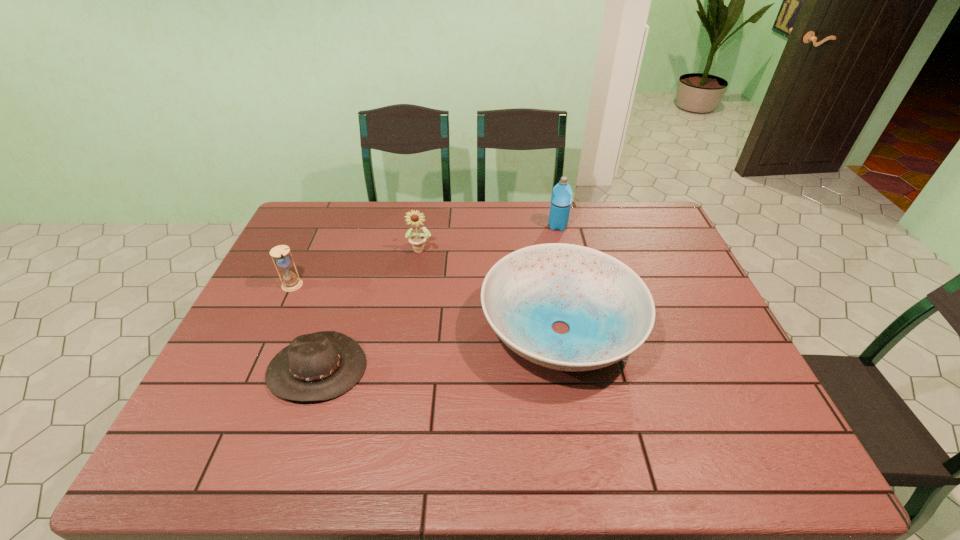
Image resolution: width=960 pixels, height=540 pixels. What are the coordinates of `the farthest object` in the screenshot? It's located at (561, 198).

Where is `the third object from left to right`? the third object from left to right is located at coordinates click(x=417, y=240).

Identify the location of sunflower. (417, 240).

Find the location of a particular element. hourglass is located at coordinates (290, 282).

What are the coordinates of `the second shortest object` in the screenshot? It's located at (610, 312).

Locate an element on the screen. The height and width of the screenshot is (540, 960). the shortest object is located at coordinates (320, 366).

The height and width of the screenshot is (540, 960). In order to click on the fourth object from right to left in this screenshot , I will do `click(320, 366)`.

Locate an element on the screen. The image size is (960, 540). vacant space located 0.180m on the right of the farthest object is located at coordinates (619, 226).

Where is `vacant point located 0.290m on the front-facing side of the sunflower`? This screenshot has width=960, height=540. vacant point located 0.290m on the front-facing side of the sunflower is located at coordinates (409, 325).

The width and height of the screenshot is (960, 540). What are the coordinates of `free space located on the right of the hourglass` in the screenshot? It's located at (323, 286).